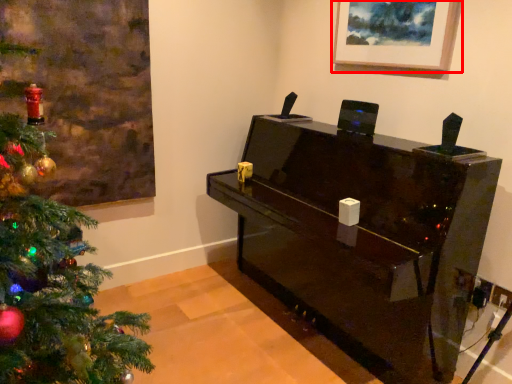
Question: From the image's perspective, where is picture frame (annotated by the red box) located relative to furniture?

Choices:
 (A) above
 (B) below

Answer: (A)